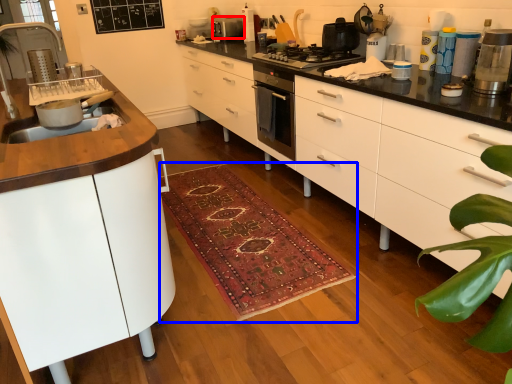
Question: Which object is closer to the camera taking this photo, kitchen appliance (highlighted by a red box) or doormat (highlighted by a blue box)?

Choices:
 (A) kitchen appliance
 (B) doormat

Answer: (B)